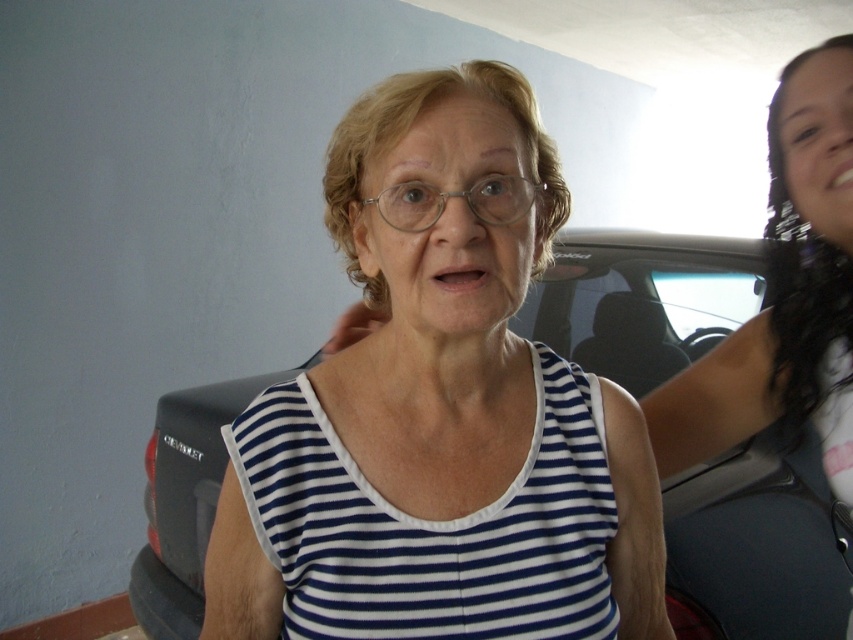
Based on the photo, you are standing in the garage and want to place a small potted plant between the metallic gray car at center and the blue and white striped tank top at center. Is this possible?

The metallic gray car at center is located below the blue and white striped tank top at center, so there is no horizontal space between them. Therefore, you cannot place the potted plant between them.

Based on the scene description, which object is taller between the metallic gray car at center and the blue and white striped tank top at center?

The metallic gray car at center is taller than the blue and white striped tank top at center according to the description.

You are an interior designer assessing the placement of items in a garage. You notice the blue and white striped tank top at center. Where is it positioned relative to the light blue wall?

The blue and white striped tank top at center is located at point (433,528), which means it is positioned closer to the right side and slightly above the center of the light blue wall.